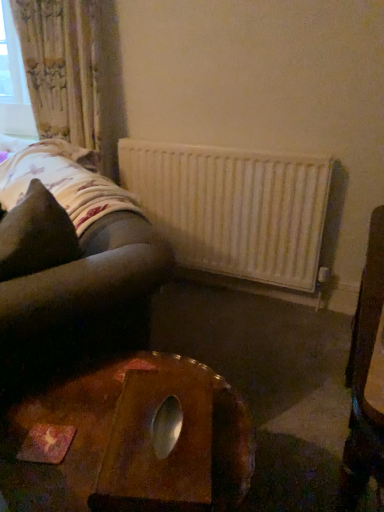
Question: Does point 107,33 appear closer or farther from the camera than point 274,274?

Choices:
 (A) farther
 (B) closer

Answer: (B)

Question: Would you say floral fabric curtain at upper left is to the left or to the right of white matte radiator at center in the picture?

Choices:
 (A) left
 (B) right

Answer: (A)

Question: Estimate the real-world distances between objects in this image. Which object is closer to the floral fabric curtain at upper left?

Choices:
 (A) white matte radiator at center
 (B) brown fabric pillow at left
 (C) wooden table at center

Answer: (A)

Question: Estimate the real-world distances between objects in this image. Which object is farther from the wooden table at center?

Choices:
 (A) floral fabric curtain at upper left
 (B) white matte radiator at center
 (C) brown fabric pillow at left

Answer: (A)